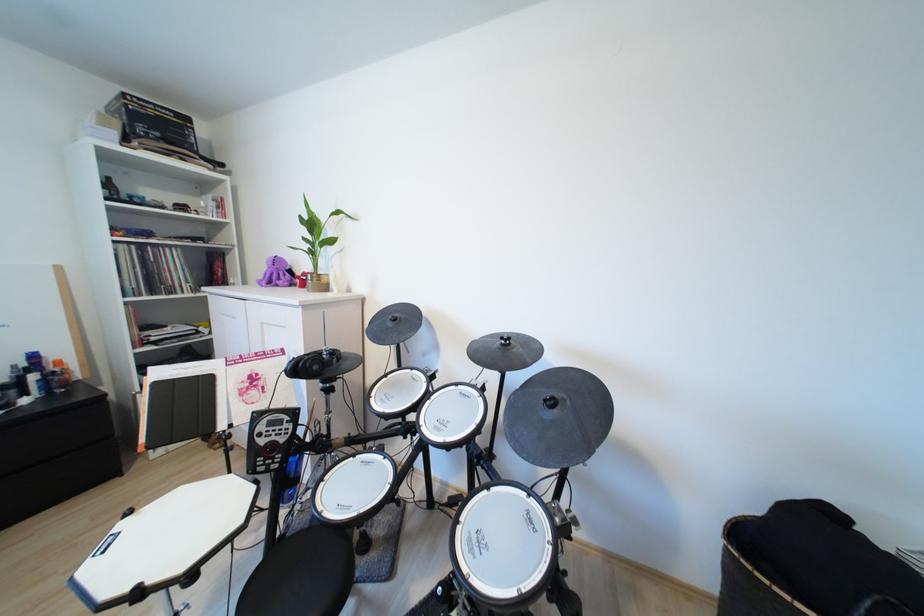
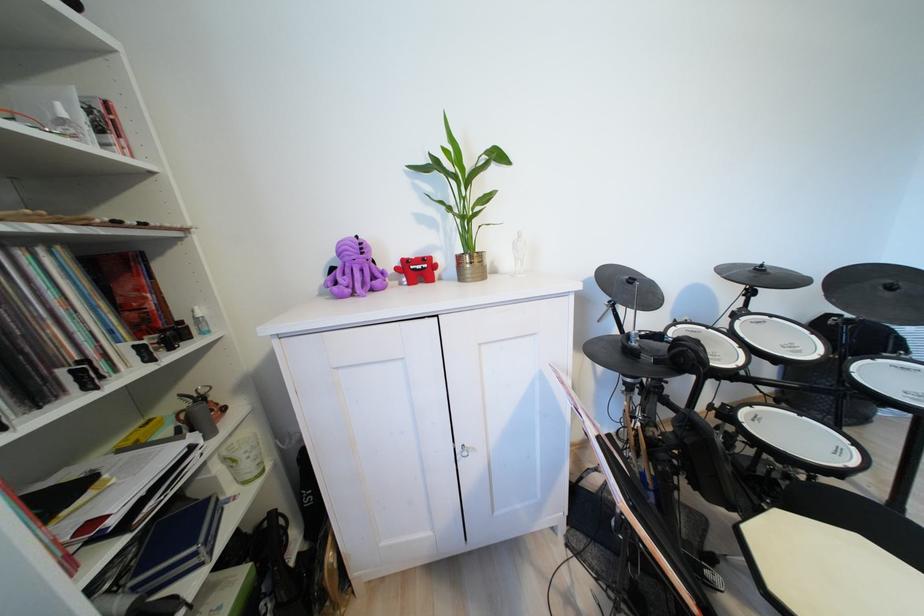
Locate, in the second image, the point that corresponds to [310,275] in the first image.

(411, 262)